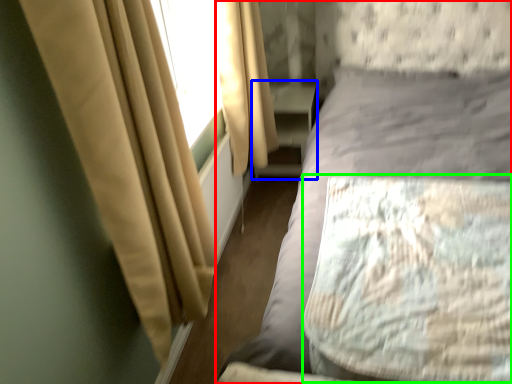
Question: Which is farther away from bed (highlighted by a red box)? dresser (highlighted by a blue box) or mattress (highlighted by a green box)?

Choices:
 (A) dresser
 (B) mattress

Answer: (A)